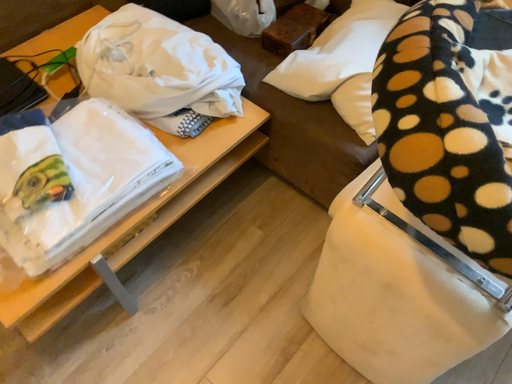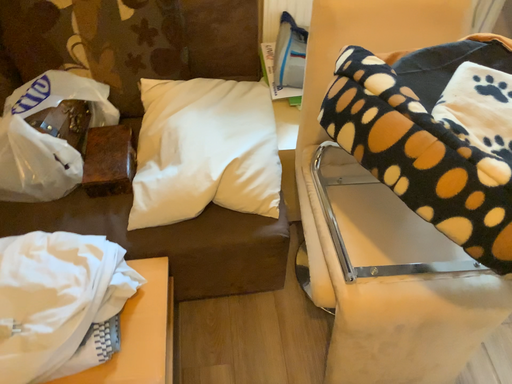
Question: Which way did the camera rotate in the video?

Choices:
 (A) rotated left
 (B) rotated right

Answer: (B)